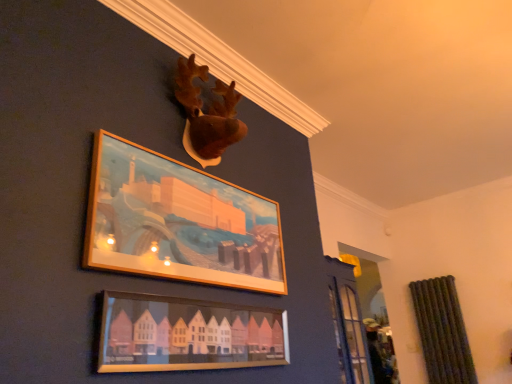
Question: Could matte wooden picture frame at lower center, which appears as the 2th picture frame when viewed from the top, be considered to be inside wooden frame at upper center, acting as the first picture frame starting from the top?

Choices:
 (A) yes
 (B) no

Answer: (B)

Question: Is wooden frame at upper center, acting as the first picture frame starting from the top, wider than matte wooden picture frame at lower center, which appears as the 2th picture frame when viewed from the top?

Choices:
 (A) yes
 (B) no

Answer: (A)

Question: Is wooden frame at upper center, the 2th picture frame ordered from the bottom, not within matte wooden picture frame at lower center, which ranks as the first picture frame in bottom-to-top order?

Choices:
 (A) yes
 (B) no

Answer: (A)

Question: Can you confirm if wooden frame at upper center, the 2th picture frame ordered from the bottom, is shorter than matte wooden picture frame at lower center, which appears as the 2th picture frame when viewed from the top?

Choices:
 (A) no
 (B) yes

Answer: (A)

Question: From the image's perspective, is wooden frame at upper center, acting as the first picture frame starting from the top, under matte wooden picture frame at lower center, which appears as the 2th picture frame when viewed from the top?

Choices:
 (A) yes
 (B) no

Answer: (B)

Question: Would you say wooden frame at upper center, the 2th picture frame ordered from the bottom, is to the left or to the right of brown plush moose head at upper center in the picture?

Choices:
 (A) left
 (B) right

Answer: (A)

Question: From their relative heights in the image, would you say wooden frame at upper center, the 2th picture frame ordered from the bottom, is taller or shorter than brown plush moose head at upper center?

Choices:
 (A) short
 (B) tall

Answer: (B)

Question: Considering the positions of wooden frame at upper center, the 2th picture frame ordered from the bottom, and brown plush moose head at upper center in the image, is wooden frame at upper center, the 2th picture frame ordered from the bottom, wider or thinner than brown plush moose head at upper center?

Choices:
 (A) thin
 (B) wide

Answer: (A)

Question: Is wooden frame at upper center, the 2th picture frame ordered from the bottom, bigger or smaller than brown plush moose head at upper center?

Choices:
 (A) small
 (B) big

Answer: (A)

Question: Considering the relative positions of brown plush moose head at upper center and matte wooden picture frame at lower center, which appears as the 2th picture frame when viewed from the top, in the image provided, is brown plush moose head at upper center to the left or to the right of matte wooden picture frame at lower center, which appears as the 2th picture frame when viewed from the top,?

Choices:
 (A) left
 (B) right

Answer: (A)

Question: Which is correct: brown plush moose head at upper center is inside matte wooden picture frame at lower center, which appears as the 2th picture frame when viewed from the top, or outside of it?

Choices:
 (A) outside
 (B) inside

Answer: (A)

Question: Looking at the image, does brown plush moose head at upper center seem bigger or smaller compared to matte wooden picture frame at lower center, which ranks as the first picture frame in bottom-to-top order?

Choices:
 (A) big
 (B) small

Answer: (A)

Question: From the image's perspective, is brown plush moose head at upper center positioned above or below matte wooden picture frame at lower center, which appears as the 2th picture frame when viewed from the top?

Choices:
 (A) above
 (B) below

Answer: (A)

Question: Is brown plush moose head at upper center to the left or to the right of wooden frame at upper center, acting as the first picture frame starting from the top, in the image?

Choices:
 (A) right
 (B) left

Answer: (A)

Question: Is brown plush moose head at upper center in front of or behind wooden frame at upper center, acting as the first picture frame starting from the top, in the image?

Choices:
 (A) behind
 (B) front

Answer: (A)